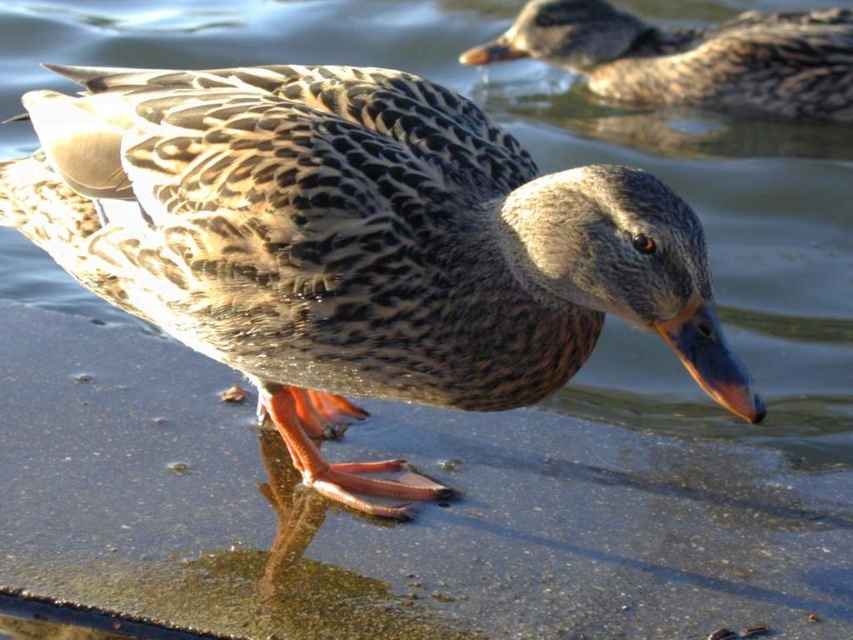
You are observing a duck scene and want to take a photo of the speckled feathered duck at center and the speckled feathered duck at upper center. Which duck will appear larger in your photo?

The speckled feathered duck at center is closer to the viewer than the speckled feathered duck at upper center, so it will appear larger in the photo.

You are observing a duck in a wet area. There are two ducks mentioned here, a speckled feathered duck at center and a speckled feathered duck at upper center. Which duck is positioned lower in the image?

The speckled feathered duck at center is located below the speckled feathered duck at upper center, so the duck at center is lower in the image.